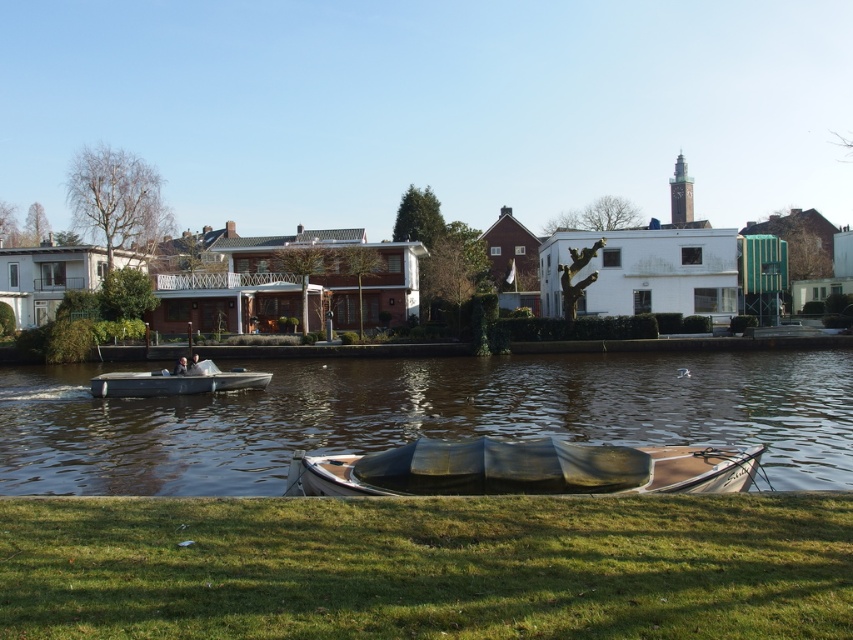
You are standing on the green grass at lower center and want to board the wooden boat at center. Which direction should you walk to reach the boat?

You should walk to the right because the green grass at lower center is to the left of the wooden boat at center, so moving right will bring you towards the boat.

You are standing at the riverside and want to walk to the wooden boat at center. Which direction should you move relative to the green grass at lower center?

You should move away from the green grass at lower center to reach the wooden boat at center since the green grass at lower center is closer to you than the wooden boat at center.

You are standing at the camera position and want to take a photo of the wooden boat at center. If your camera has a maximum focus range of 25 feet, will you be able to capture the boat clearly?

The wooden boat at center is 26.29 feet away from the camera, which exceeds the maximum focus range of 25 feet. Therefore, the boat will not be in clear focus.